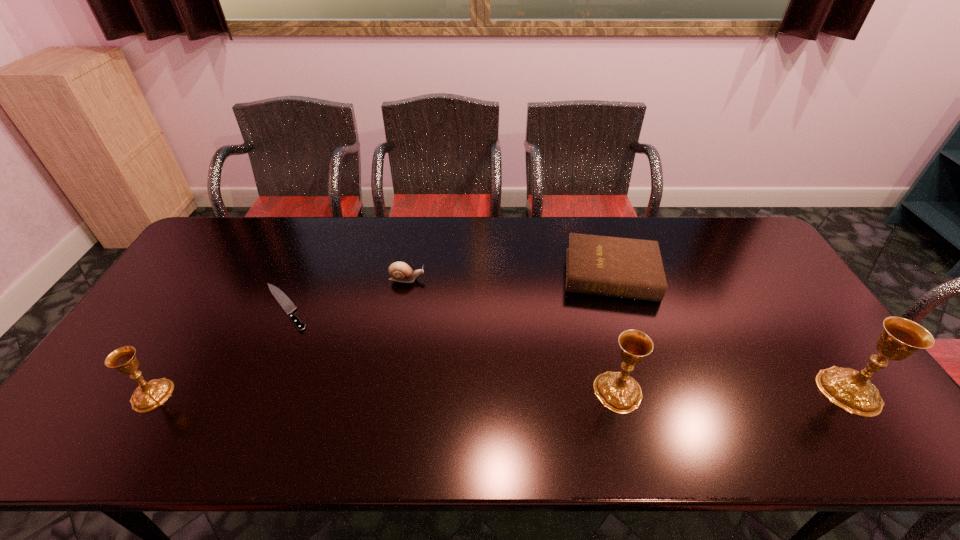
Identify the location of vacant region between the third object from left to right and the leftmost chalice. (279, 337).

Image resolution: width=960 pixels, height=540 pixels. I want to click on vacant space in between the escargot and the Bible, so tap(509, 276).

At what (x,y) coordinates should I click in order to perform the action: click on free space between the rightmost chalice and the steak knife. Please return your answer as a coordinate pair (x, y). The width and height of the screenshot is (960, 540). Looking at the image, I should click on (567, 349).

You are a GUI agent. You are given a task and a screenshot of the screen. Output one action in this format:
    pyautogui.click(x=<x>, y=<y>)
    Task: Click on the empty space that is in between the second shortest chalice and the tallest object
    The height and width of the screenshot is (540, 960).
    Given the screenshot: What is the action you would take?
    pyautogui.click(x=733, y=391)

You are a GUI agent. You are given a task and a screenshot of the screen. Output one action in this format:
    pyautogui.click(x=<x>, y=<y>)
    Task: Click on the object identified as the fifth closest to the shortest chalice
    Image resolution: width=960 pixels, height=540 pixels.
    Given the screenshot: What is the action you would take?
    852,390

Find the location of a particular element. The image size is (960, 540). object that ranks as the closest to the second tallest object is located at coordinates (629, 268).

What are the coordinates of `chalice identified as the third closest to the Bible` in the screenshot? It's located at (147, 396).

Point out which chalice is positioned as the second nearest to the shortest chalice. Please provide its 2D coordinates. Your answer should be formatted as a tuple, i.e. [(x, y)], where the tuple contains the x and y coordinates of a point satisfying the conditions above.

[(852, 390)]

Locate an element on the screen. The width and height of the screenshot is (960, 540). free space that satisfies the following two spatial constraints: 1. on the front-facing side of the escargot; 2. on the back side of the rightmost chalice is located at coordinates (387, 390).

The height and width of the screenshot is (540, 960). What are the coordinates of `free space that satisfies the following two spatial constraints: 1. on the front side of the Bible; 2. on the front-facing side of the fourth object from right to left` in the screenshot? It's located at (612, 279).